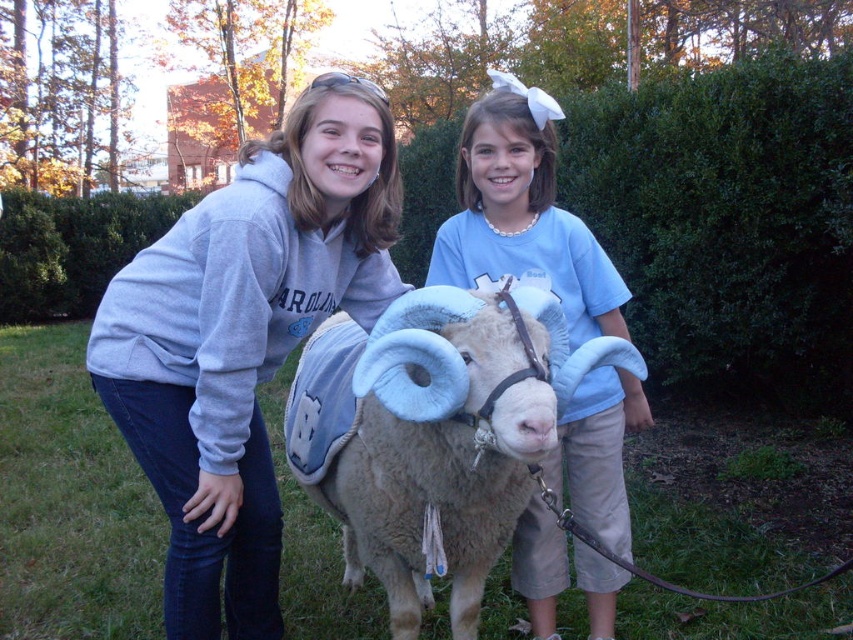
You are a photographer trying to capture a photo of the light brown woolen sheep at center and the blue cotton shirt at center. Which object should you focus on first if you want to ensure both are in focus, given that your camera can only focus on one object at a time?

The light brown woolen sheep at center is below the blue cotton shirt at center, so you should focus on the blue cotton shirt at center first to ensure both are in focus.

Based on the photo, you are trying to decide which clothing item to grab first. The gray fleece sweatshirt at left and the blue cotton shirt at center are both within reach. Which one is closer to you?

The gray fleece sweatshirt at left is positioned over the blue cotton shirt at center, so it is closer to you.

You are standing in a field and see the light brown woolen sheep at center and the blue cotton shirt at center. Which one is closer to your left side?

The light brown woolen sheep at center is closer to your left side because it is positioned to the left of the blue cotton shirt at center.